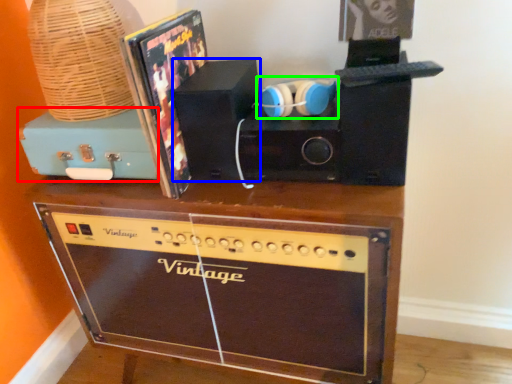
Question: Based on their relative distances, which object is farther from cassette (highlighted by a red box)? Choose from speaker (highlighted by a blue box) and headphones (highlighted by a green box).

Choices:
 (A) speaker
 (B) headphones

Answer: (B)